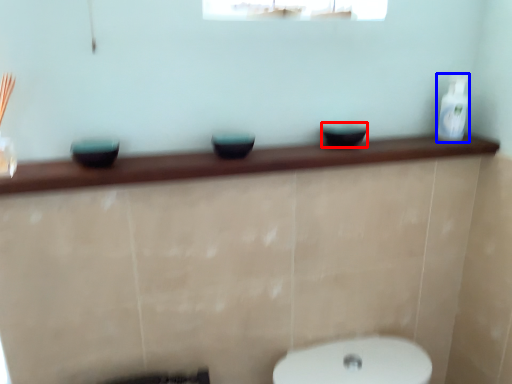
Question: Which of the following is the closest to the observer, basin (highlighted by a red box) or toiletry (highlighted by a blue box)?

Choices:
 (A) basin
 (B) toiletry

Answer: (A)